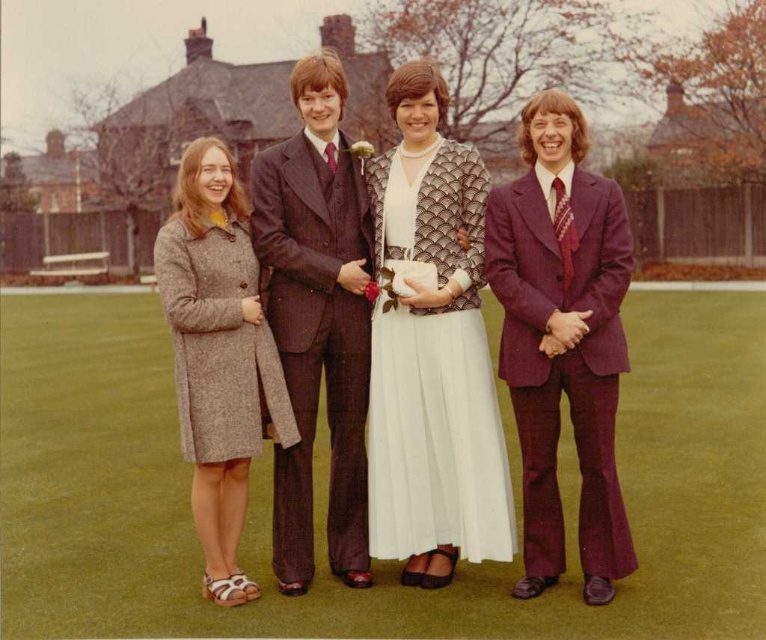
Is matte brown coat at left above maroon textured suit at right?

No.

Is matte brown coat at left below maroon textured suit at right?

Correct, matte brown coat at left is located below maroon textured suit at right.

Locate an element on the screen. This screenshot has height=640, width=766. matte brown coat at left is located at coordinates (430, 349).

Is matte brown coat at left smaller than brown pinstripe suit at center?

No.

Who is more forward, (421, 532) or (365, 326)?

Positioned in front is point (421, 532).

I want to click on matte brown coat at left, so click(430, 349).

Which is below, matte brown coat at left or white pleated dress at center?

Positioned lower is white pleated dress at center.

Can you confirm if matte brown coat at left is shorter than white pleated dress at center?

Incorrect, matte brown coat at left's height does not fall short of white pleated dress at center's.

Does point (555, 193) lie behind point (426, 520)?

No.

You are a GUI agent. You are given a task and a screenshot of the screen. Output one action in this format:
    pyautogui.click(x=<x>, y=<y>)
    Task: Click on the matte brown coat at left
    The image size is (766, 640).
    Given the screenshot: What is the action you would take?
    pyautogui.click(x=430, y=349)